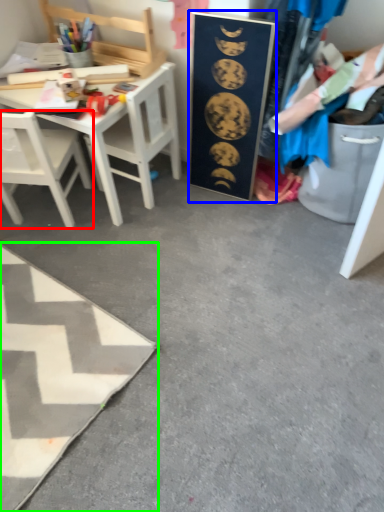
Question: Which is farther away from chair (highlighted by a red box)? bulletin board (highlighted by a blue box) or table (highlighted by a green box)?

Choices:
 (A) bulletin board
 (B) table

Answer: (A)